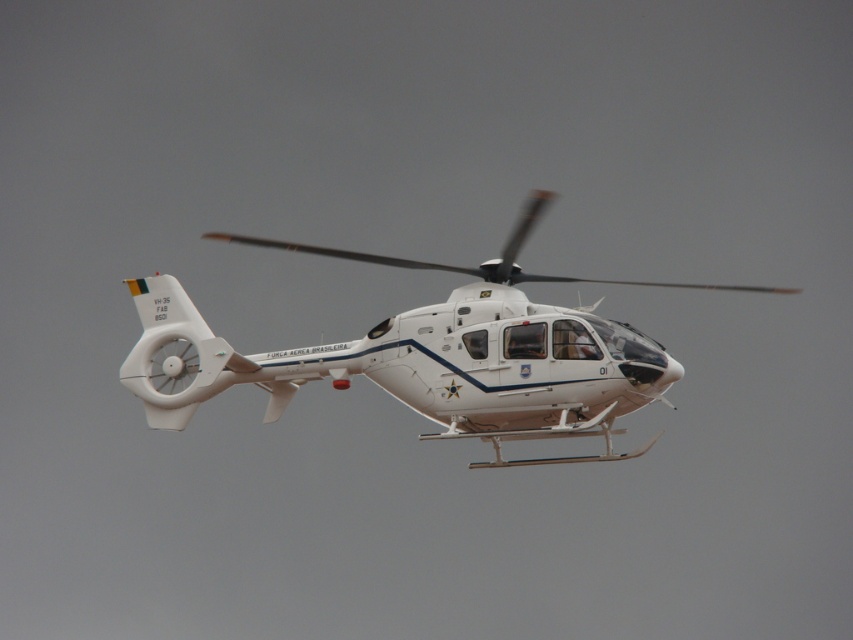
You are a pilot observing the white glossy helicopter at center and the white matte propeller at center from the ground. Which object is closer to you?

The white glossy helicopter at center is closer to you because it is positioned in front of the white matte propeller at center.